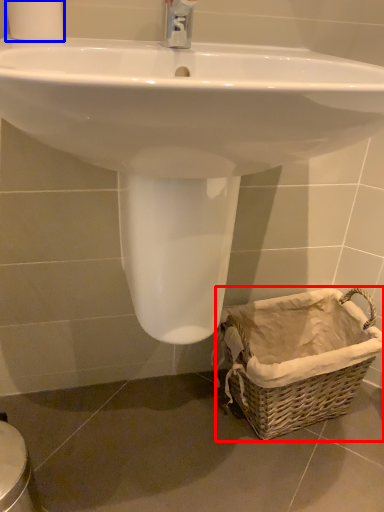
Question: Which object is closer to the camera taking this photo, basket (highlighted by a red box) or toilet paper (highlighted by a blue box)?

Choices:
 (A) basket
 (B) toilet paper

Answer: (B)